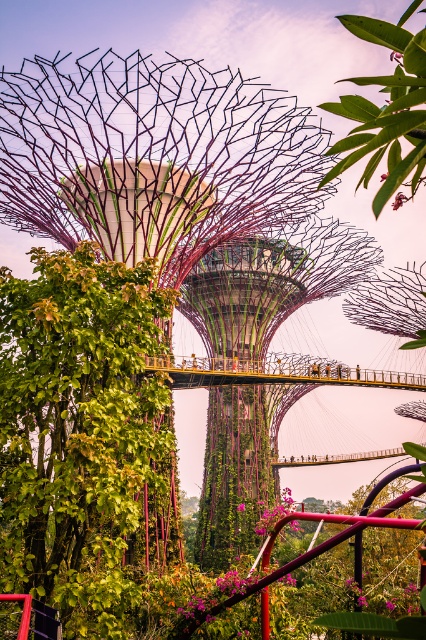
Question: Which is nearer to the green leafy tree at upper center?

Choices:
 (A) green textured tower at center
 (B) green leafy plant at left

Answer: (B)

Question: Does green leafy plant at left appear on the left side of green leafy tree at upper center?

Choices:
 (A) yes
 (B) no

Answer: (A)

Question: Can you confirm if green leafy plant at left is bigger than green textured tower at center?

Choices:
 (A) no
 (B) yes

Answer: (A)

Question: Which object is farther from the camera taking this photo?

Choices:
 (A) green leafy plant at left
 (B) green textured tower at center
 (C) green leafy tree at upper center

Answer: (B)

Question: Which object is farther from the camera taking this photo?

Choices:
 (A) green leafy plant at left
 (B) green textured tower at center
 (C) green leafy tree at upper center

Answer: (B)

Question: Is green textured tower at center positioned in front of green leafy tree at upper center?

Choices:
 (A) yes
 (B) no

Answer: (B)